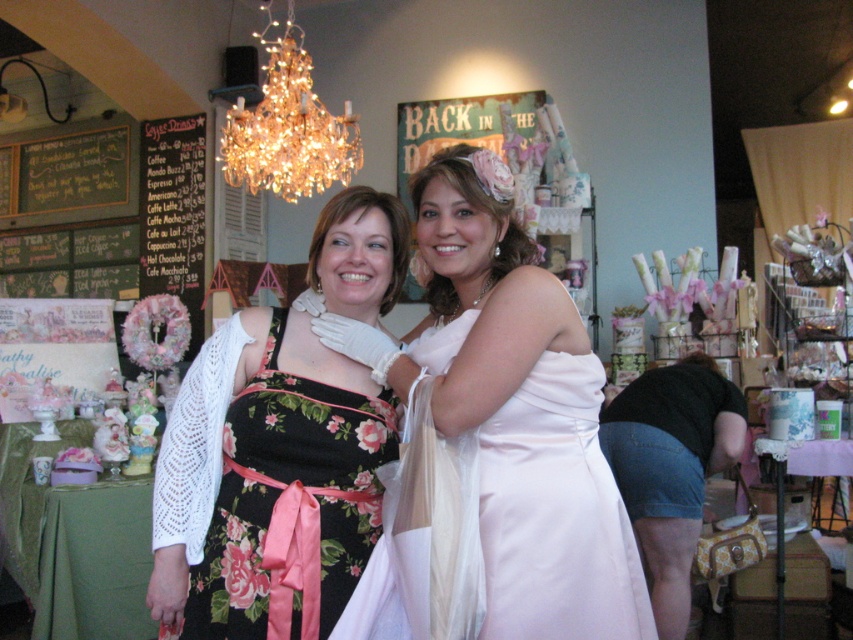
Is point (283, 108) closer to viewer compared to point (157, 273)?

That is True.

Who is more distant from viewer, (346, 157) or (202, 259)?

The point (202, 259) is more distant.

Where is `crystal gold chandelier at upper center`? crystal gold chandelier at upper center is located at coordinates (288, 125).

I want to click on crystal gold chandelier at upper center, so click(288, 125).

Consider the image. Who is taller, floral dress at center or black chalkboard menu at left?

black chalkboard menu at left is taller.

Image resolution: width=853 pixels, height=640 pixels. What do you see at coordinates (283, 492) in the screenshot? I see `floral dress at center` at bounding box center [283, 492].

At what (x,y) coordinates should I click in order to perform the action: click on floral dress at center. Please return your answer as a coordinate pair (x, y). The width and height of the screenshot is (853, 640). Looking at the image, I should click on (283, 492).

Does satin dress at center appear over floral dress at center?

Indeed, satin dress at center is positioned over floral dress at center.

Between satin dress at center and floral dress at center, which one appears on the left side from the viewer's perspective?

floral dress at center is more to the left.

What do you see at coordinates (514, 410) in the screenshot?
I see `satin dress at center` at bounding box center [514, 410].

Identify the location of satin dress at center. (514, 410).